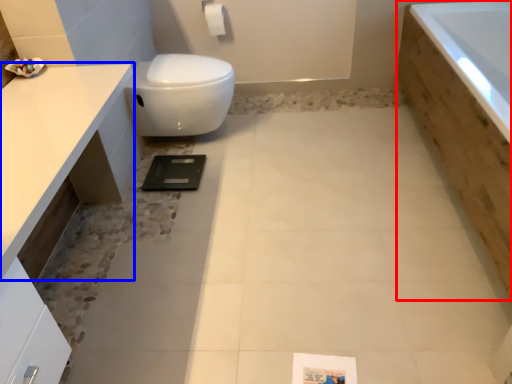
Question: Which point is further to the camera, bath (highlighted by a red box) or countertop (highlighted by a blue box)?

Choices:
 (A) bath
 (B) countertop

Answer: (A)